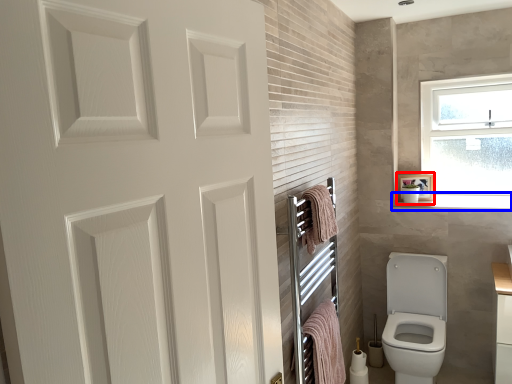
Question: Which of the following is the farthest to the observer, medicine cabinet (highlighted by a red box) or window sill (highlighted by a blue box)?

Choices:
 (A) medicine cabinet
 (B) window sill

Answer: (A)